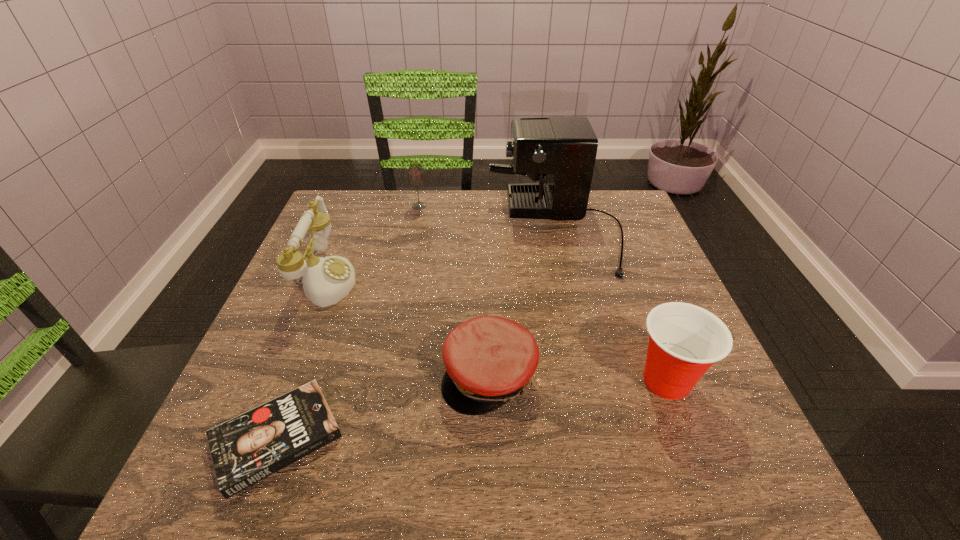
Find the location of `the tallest object`. the tallest object is located at coordinates (564, 149).

In order to click on telephone in this screenshot , I will do `click(326, 280)`.

In order to click on cup in this screenshot , I will do `click(685, 340)`.

At what (x,y) coordinates should I click in order to perform the action: click on glass drink container. Please return your answer as a coordinate pair (x, y). The image size is (960, 540). Looking at the image, I should click on (416, 178).

This screenshot has height=540, width=960. What are the coordinates of `the fifth tallest object` in the screenshot? It's located at (488, 359).

Find the location of a particular element. book is located at coordinates (x=246, y=449).

This screenshot has height=540, width=960. I want to click on vacant space positioned on the front-facing side of the tallest object, so click(372, 230).

Find the location of `vacant area located 0.280m on the front-facing side of the tallest object`. vacant area located 0.280m on the front-facing side of the tallest object is located at coordinates (384, 230).

The width and height of the screenshot is (960, 540). I want to click on vacant area situated on the front-facing side of the tallest object, so click(x=470, y=230).

Find the location of a particular element. vacant space located on the dial of the second tallest object is located at coordinates coord(426,279).